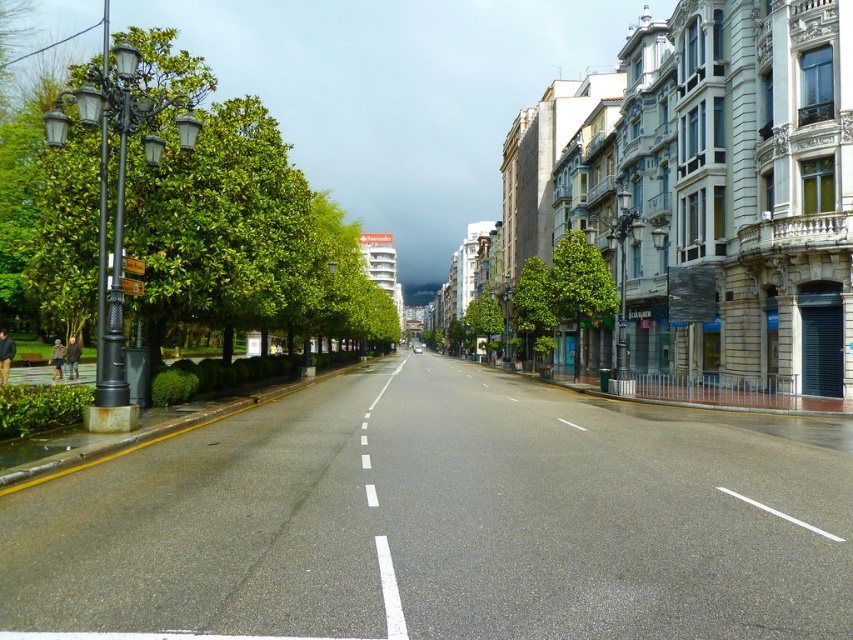
Between green leafy tree at left and green leafy tree at center, which one appears on the right side from the viewer's perspective?

green leafy tree at center is more to the right.

Identify the location of green leafy tree at left. The image size is (853, 640). (242, 234).

Between point (321, 324) and point (532, 333), which one is positioned behind?

Point (532, 333)

Locate an element on the screen. This screenshot has height=640, width=853. green leafy tree at left is located at coordinates (242, 234).